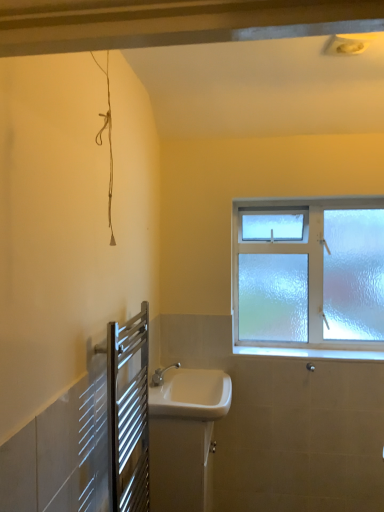
Question: Looking at their shapes, would you say white glossy sink at lower center, the first sink ordered from the bottom, is wider or thinner than frosted glass window at upper right?

Choices:
 (A) thin
 (B) wide

Answer: (B)

Question: Do you think white glossy sink at lower center, the 2th sink viewed from the top, is within frosted glass window at upper right, or outside of it?

Choices:
 (A) inside
 (B) outside

Answer: (B)

Question: Estimate the real-world distances between objects in this image. Which object is closer to the white ceramic sink at center, which is counted as the 1th sink, starting from the top?

Choices:
 (A) silver metallic towel rack at lower left
 (B) frosted glass window at upper right
 (C) white glossy sink at lower center, the first sink ordered from the bottom

Answer: (C)

Question: Based on their relative distances, which object is farther from the silver metallic towel rack at lower left?

Choices:
 (A) white glossy sink at lower center, the 2th sink viewed from the top
 (B) frosted glass window at upper right
 (C) white ceramic sink at center, marked as the second sink in a bottom-to-top arrangement

Answer: (B)